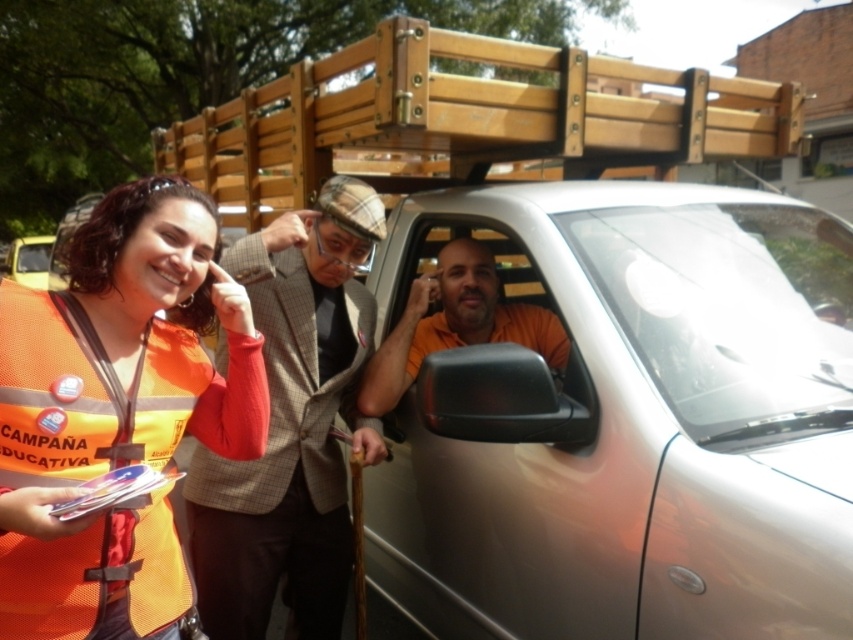
Is point (64, 440) behind point (526, 100)?

No.

Between orange reflective vest at left and wooden at upper center, which one is positioned lower?

orange reflective vest at left is below.

Does point (206, 422) come behind point (480, 138)?

No, (206, 422) is closer to viewer.

Locate an element on the screen. The height and width of the screenshot is (640, 853). orange reflective vest at left is located at coordinates [x=117, y=412].

Is orange reflective vest at left to the right of orange matte shirt at center from the viewer's perspective?

Incorrect, orange reflective vest at left is not on the right side of orange matte shirt at center.

Based on the photo, who is positioned more to the left, orange reflective vest at left or orange matte shirt at center?

From the viewer's perspective, orange reflective vest at left appears more on the left side.

Does point (22, 531) come behind point (514, 312)?

No, (22, 531) is closer to viewer.

Locate an element on the screen. Image resolution: width=853 pixels, height=640 pixels. orange reflective vest at left is located at coordinates (117, 412).

Is silver metallic car at center bigger than wooden at upper center?

Incorrect, silver metallic car at center is not larger than wooden at upper center.

Does silver metallic car at center appear on the left side of wooden at upper center?

Incorrect, silver metallic car at center is not on the left side of wooden at upper center.

This screenshot has height=640, width=853. Describe the element at coordinates (625, 419) in the screenshot. I see `silver metallic car at center` at that location.

Locate an element on the screen. silver metallic car at center is located at coordinates (625, 419).